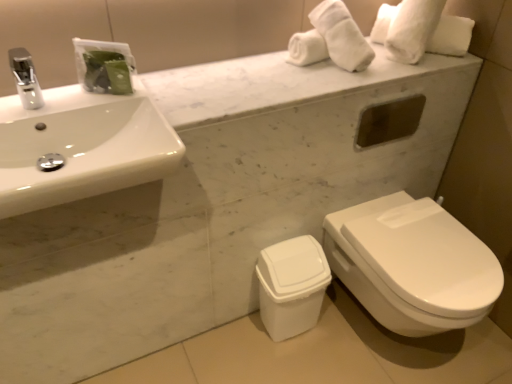
Question: Is silver metallic faucet at upper left to the right of white glossy sink at upper left from the viewer's perspective?

Choices:
 (A) no
 (B) yes

Answer: (A)

Question: Considering the relative positions of silver metallic faucet at upper left and white glossy sink at upper left in the image provided, is silver metallic faucet at upper left to the left of white glossy sink at upper left from the viewer's perspective?

Choices:
 (A) yes
 (B) no

Answer: (A)

Question: Does silver metallic faucet at upper left have a greater width compared to white glossy sink at upper left?

Choices:
 (A) yes
 (B) no

Answer: (B)

Question: Is the position of silver metallic faucet at upper left less distant than that of white glossy sink at upper left?

Choices:
 (A) no
 (B) yes

Answer: (A)

Question: Is silver metallic faucet at upper left behind white glossy sink at upper left?

Choices:
 (A) no
 (B) yes

Answer: (B)

Question: From a real-world perspective, does silver metallic faucet at upper left stand above white glossy sink at upper left?

Choices:
 (A) yes
 (B) no

Answer: (A)

Question: Would you say white glossy sink at upper left is outside white glossy toilet at lower right?

Choices:
 (A) yes
 (B) no

Answer: (A)

Question: Is white glossy toilet at lower right at the back of white glossy sink at upper left?

Choices:
 (A) yes
 (B) no

Answer: (B)

Question: Can you confirm if white glossy sink at upper left is taller than white glossy toilet at lower right?

Choices:
 (A) yes
 (B) no

Answer: (B)

Question: Does white glossy sink at upper left have a lesser height compared to white glossy toilet at lower right?

Choices:
 (A) yes
 (B) no

Answer: (A)

Question: Can you see white glossy sink at upper left touching white glossy toilet at lower right?

Choices:
 (A) yes
 (B) no

Answer: (B)

Question: Is white glossy sink at upper left at the right side of white glossy toilet at lower right?

Choices:
 (A) no
 (B) yes

Answer: (A)

Question: Considering the relative positions of white glossy sink at upper left and silver metallic faucet at upper left in the image provided, is white glossy sink at upper left to the right of silver metallic faucet at upper left from the viewer's perspective?

Choices:
 (A) yes
 (B) no

Answer: (A)